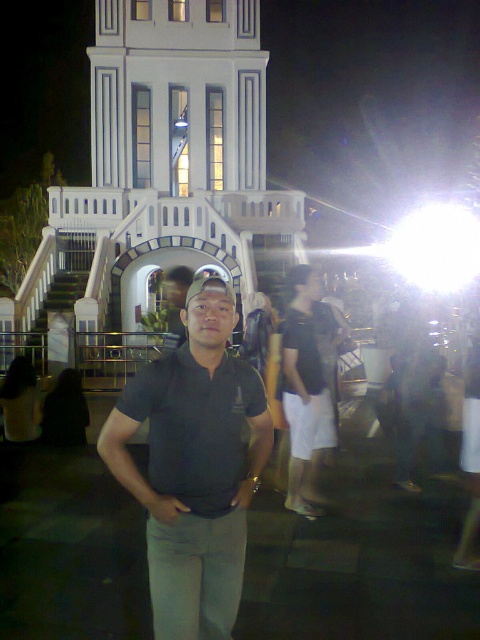
You are a photographer trying to capture the white smooth tower at center and the matte black polo shirt at center in a single frame. Based on their sizes, which object would likely occupy more space in the photo?

The white smooth tower at center might be wider than the matte black polo shirt at center, so it would likely occupy more space in the photo.

You are a photographer trying to capture a photo of the white smooth tower at center and the matte black polo shirt at center. Based on their sizes in the image, which object would appear more dominant in the composition?

The white smooth tower at center appears more dominant in the composition because it has a larger size compared to the matte black polo shirt at center.

You are a photographer reviewing a photo of two polo shirts displayed at a store. The matte black polo shirt at center and the dark gray cotton polo shirt at center are both on display. According to the image, which polo shirt appears taller?

The matte black polo shirt at center appears taller than the dark gray cotton polo shirt at center.